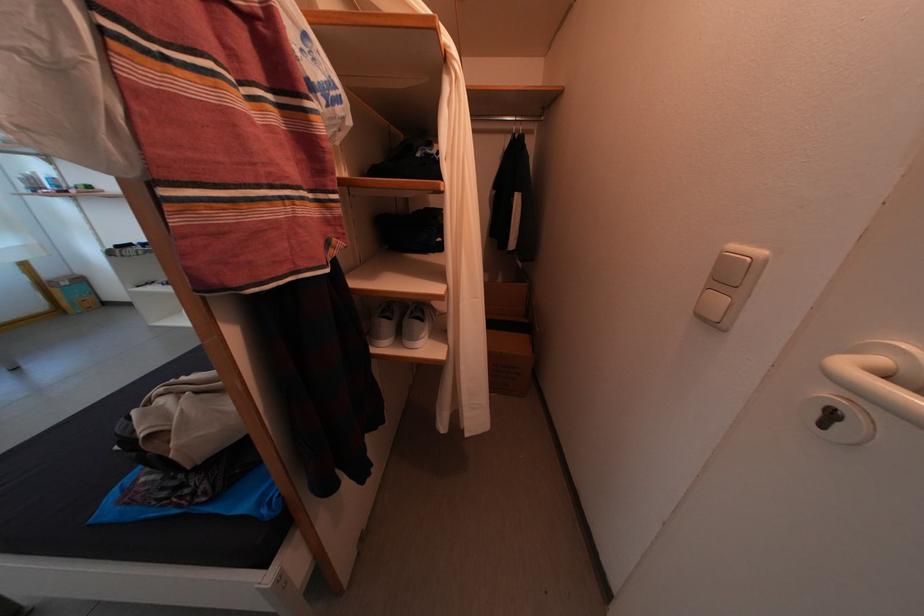
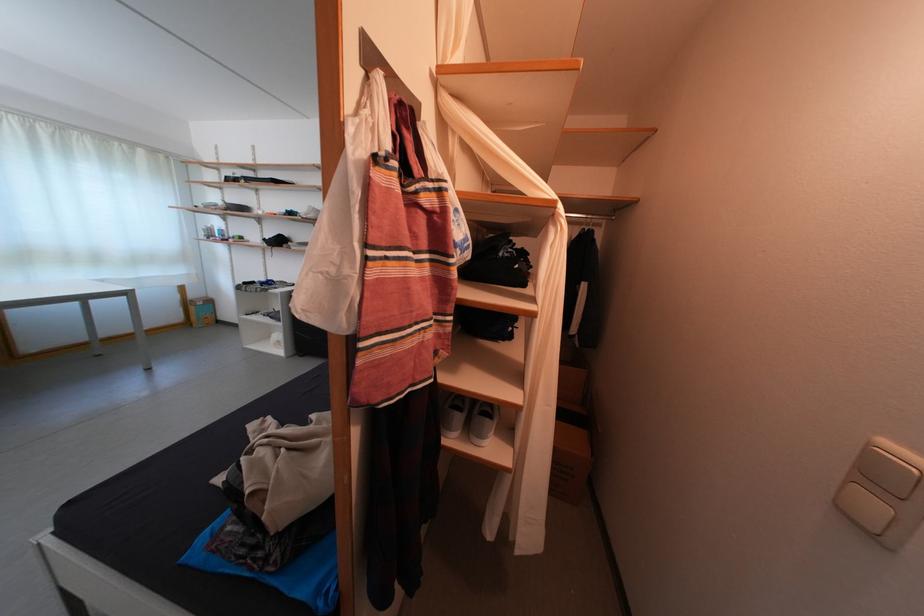
The point at (409, 341) is marked in the first image. Where is the corresponding point in the second image?

(479, 435)